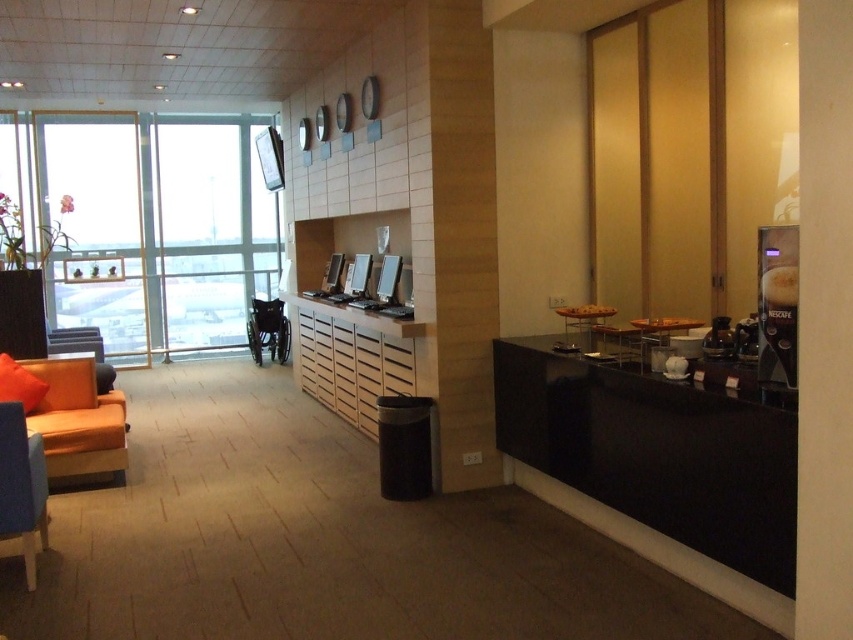
Question: Is transparent glass window at left positioned at the back of orange fabric couch at left?

Choices:
 (A) no
 (B) yes

Answer: (B)

Question: Does transparent glass window at left appear under orange fabric couch at left?

Choices:
 (A) no
 (B) yes

Answer: (A)

Question: Which of the following is the farthest from the observer?

Choices:
 (A) (28, 440)
 (B) (114, 291)
 (C) (252, 340)

Answer: (B)

Question: Where is orange fabric couch at left located in relation to black plastic wheelchair at center in the image?

Choices:
 (A) left
 (B) right

Answer: (A)

Question: Which object is positioned closest to the transparent glass window at left?

Choices:
 (A) orange fabric couch at left
 (B) black plastic wheelchair at center
 (C) blue fabric chair at lower left

Answer: (B)

Question: Which of these objects is positioned farthest from the transparent glass window at left?

Choices:
 (A) orange fabric couch at left
 (B) blue fabric chair at lower left

Answer: (B)